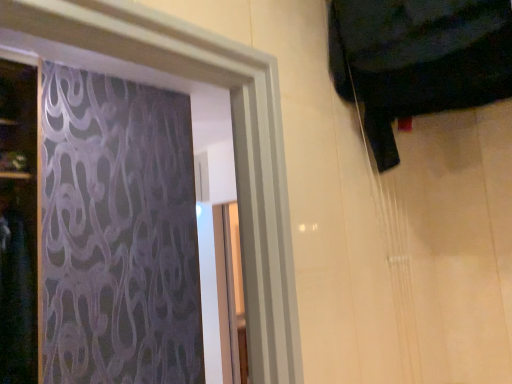
The width and height of the screenshot is (512, 384). Identify the location of dark wood door at left. (18, 224).

The image size is (512, 384). What do you see at coordinates (18, 224) in the screenshot? I see `dark wood door at left` at bounding box center [18, 224].

The height and width of the screenshot is (384, 512). Find the location of `black fabric at upper right`. black fabric at upper right is located at coordinates (417, 60).

Describe the element at coordinates (417, 60) in the screenshot. The width and height of the screenshot is (512, 384). I see `black fabric at upper right` at that location.

This screenshot has height=384, width=512. Find the location of `dark wood door at left`. dark wood door at left is located at coordinates (18, 224).

Which is more to the left, black fabric at upper right or dark wood door at left?

From the viewer's perspective, dark wood door at left appears more on the left side.

Which object is more forward, black fabric at upper right or dark wood door at left?

black fabric at upper right is more forward.

Considering the points (410, 73) and (34, 227), which point is in front, point (410, 73) or point (34, 227)?

The point (410, 73) is closer to the camera.

From the image's perspective, which one is positioned lower, black fabric at upper right or dark wood door at left?

From the image's view, dark wood door at left is below.

From a real-world perspective, is black fabric at upper right positioned over dark wood door at left based on gravity?

Yes.

Which of these two, black fabric at upper right or dark wood door at left, is thinner?

With smaller width is black fabric at upper right.

Does black fabric at upper right have a lesser height compared to dark wood door at left?

Correct, black fabric at upper right is not as tall as dark wood door at left.

Is black fabric at upper right bigger than dark wood door at left?

No.

Would you say black fabric at upper right is inside or outside dark wood door at left?

black fabric at upper right cannot be found inside dark wood door at left.

Is black fabric at upper right with dark wood door at left?

No, black fabric at upper right is not making contact with dark wood door at left.

Is black fabric at upper right oriented away from dark wood door at left?

No, black fabric at upper right is not facing the opposite direction of dark wood door at left.

How distant is black fabric at upper right from dark wood door at left?

They are 5.43 feet apart.

Where is `curtain above the dark wood door at left (from the image's perspective)`? The width and height of the screenshot is (512, 384). curtain above the dark wood door at left (from the image's perspective) is located at coordinates (417, 60).

Looking at this image, considering the positions of objects dark wood door at left and black fabric at upper right in the image provided, who is more to the right, dark wood door at left or black fabric at upper right?

black fabric at upper right is more to the right.

Is dark wood door at left positioned behind black fabric at upper right?

Yes, the depth of dark wood door at left is greater than that of black fabric at upper right.

Which point is more forward, [5,196] or [482,5]?

Positioned in front is point [482,5].

From the image's perspective, is dark wood door at left above or below black fabric at upper right?

From the image's perspective, dark wood door at left appears below black fabric at upper right.

From a real-world perspective, who is located higher, dark wood door at left or black fabric at upper right?

black fabric at upper right.

In the scene shown: Is dark wood door at left wider or thinner than black fabric at upper right?

Clearly, dark wood door at left has more width compared to black fabric at upper right.

In terms of height, does dark wood door at left look taller or shorter compared to black fabric at upper right?

Clearly, dark wood door at left is taller compared to black fabric at upper right.

In terms of size, does dark wood door at left appear bigger or smaller than black fabric at upper right?

In the image, dark wood door at left appears to be larger than black fabric at upper right.

Would you say dark wood door at left is inside or outside black fabric at upper right?

dark wood door at left cannot be found inside black fabric at upper right.

Is dark wood door at left in contact with black fabric at upper right?

dark wood door at left and black fabric at upper right are clearly separated.

Is dark wood door at left looking in the opposite direction of black fabric at upper right?

No, black fabric at upper right is not at the back of dark wood door at left.

Locate an element on the screen. The image size is (512, 384). curtain located on the right of dark wood door at left is located at coordinates (417, 60).

The height and width of the screenshot is (384, 512). I want to click on door that is behind the black fabric at upper right, so click(18, 224).

Image resolution: width=512 pixels, height=384 pixels. I want to click on door below the black fabric at upper right (from a real-world perspective), so click(x=18, y=224).